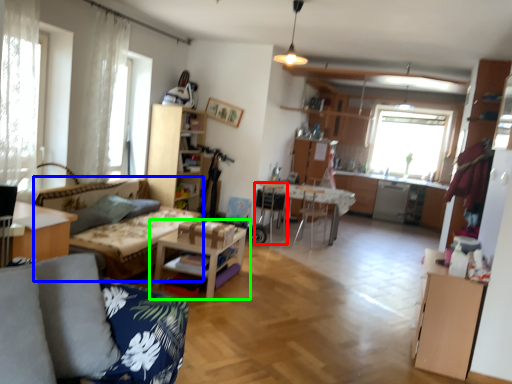
Question: Estimate the real-world distances between objects in this image. Which object is farther from armchair (highlighted by a red box), couch (highlighted by a blue box) or table (highlighted by a green box)?

Choices:
 (A) couch
 (B) table

Answer: (B)